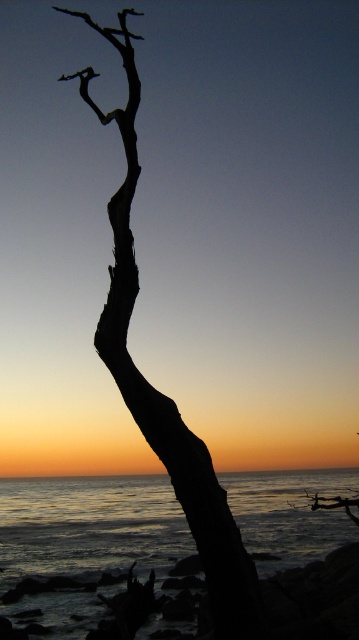
Question: Does silvery reflective water at lower center appear over black matte tree at center?

Choices:
 (A) yes
 (B) no

Answer: (B)

Question: Which point is farther to the camera?

Choices:
 (A) (330, 529)
 (B) (238, 637)

Answer: (A)

Question: Does silvery reflective water at lower center have a larger size compared to black matte tree at center?

Choices:
 (A) yes
 (B) no

Answer: (A)

Question: Which point is closer to the camera?

Choices:
 (A) (184, 506)
 (B) (17, 506)

Answer: (A)

Question: Does silvery reflective water at lower center appear under black matte tree at center?

Choices:
 (A) yes
 (B) no

Answer: (A)

Question: Which point is farther to the camera?

Choices:
 (A) silvery reflective water at lower center
 (B) black matte tree at center

Answer: (A)